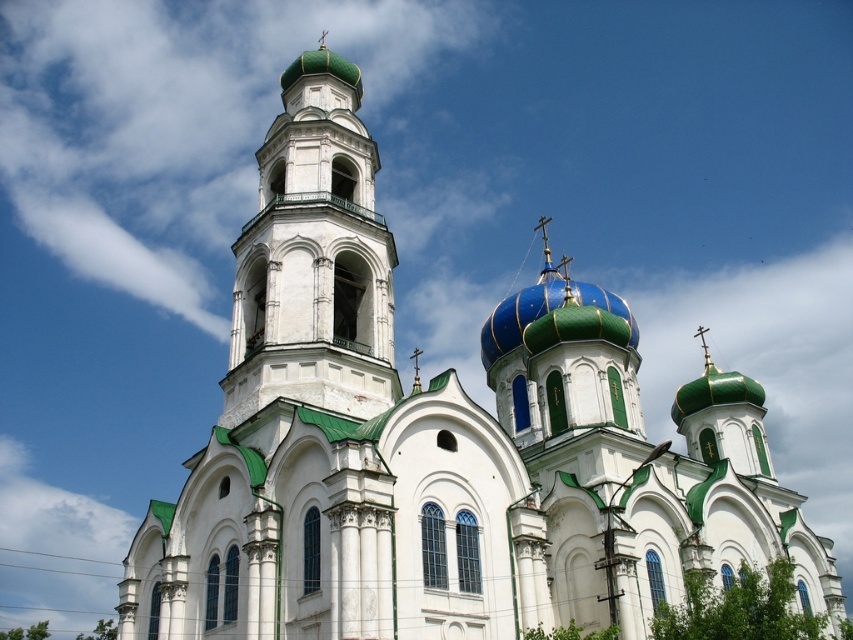
Can you confirm if white stone bell tower at center is positioned above blue metallic dome at center?

Yes.

Describe the element at coordinates (312, 259) in the screenshot. This screenshot has width=853, height=640. I see `white stone bell tower at center` at that location.

This screenshot has height=640, width=853. I want to click on white stone bell tower at center, so click(312, 259).